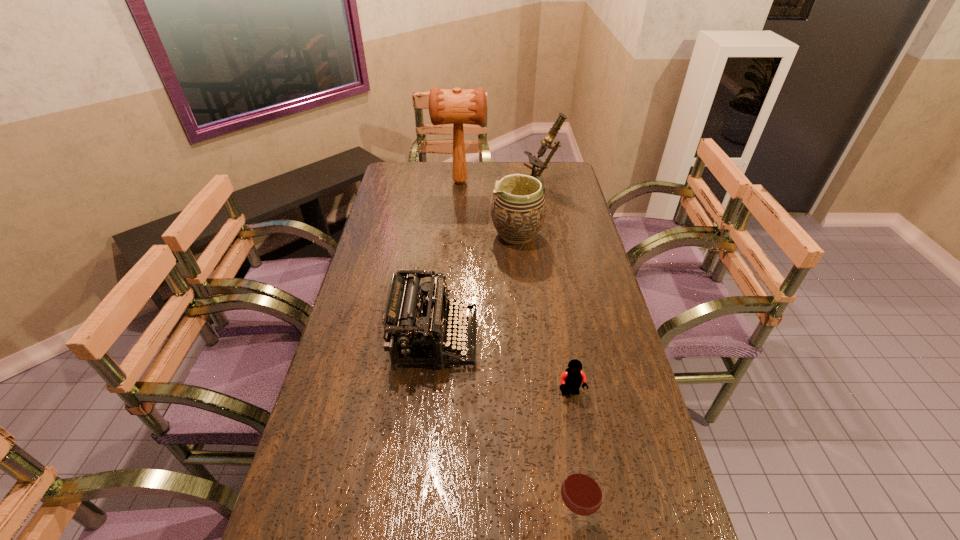
Find the location of `vacant region between the fourth shortest object and the fifth farthest object`. vacant region between the fourth shortest object and the fifth farthest object is located at coordinates (543, 314).

The image size is (960, 540). In order to click on free area in between the mallet and the fourth tallest object in this screenshot , I will do `click(447, 260)`.

Where is `vacant point located between the nearest object and the second tallest object`? This screenshot has width=960, height=540. vacant point located between the nearest object and the second tallest object is located at coordinates (557, 352).

Where is `free space that is in between the tallest object and the third farthest object`? free space that is in between the tallest object and the third farthest object is located at coordinates (489, 208).

The height and width of the screenshot is (540, 960). Find the location of `free space between the second shortest object and the fourth nearest object`. free space between the second shortest object and the fourth nearest object is located at coordinates (545, 376).

Locate an element on the screen. The width and height of the screenshot is (960, 540). free area in between the nearest object and the pottery is located at coordinates (545, 376).

This screenshot has height=540, width=960. Identify the location of object identified as the third closest to the tallest object. (414, 326).

This screenshot has width=960, height=540. Find the location of `object that is the nearest to the fourth nearest object`. object that is the nearest to the fourth nearest object is located at coordinates (536, 163).

The height and width of the screenshot is (540, 960). Find the location of `free region that satisfies the following two spatial constraints: 1. at the eyepiece of the microscope; 2. on the front side of the pottery`. free region that satisfies the following two spatial constraints: 1. at the eyepiece of the microscope; 2. on the front side of the pottery is located at coordinates (550, 235).

This screenshot has height=540, width=960. Find the location of `free spot that satisfies the following two spatial constraints: 1. on the strike surface of the tallest object; 2. on the back side of the fourth nearest object`. free spot that satisfies the following two spatial constraints: 1. on the strike surface of the tallest object; 2. on the back side of the fourth nearest object is located at coordinates (457, 235).